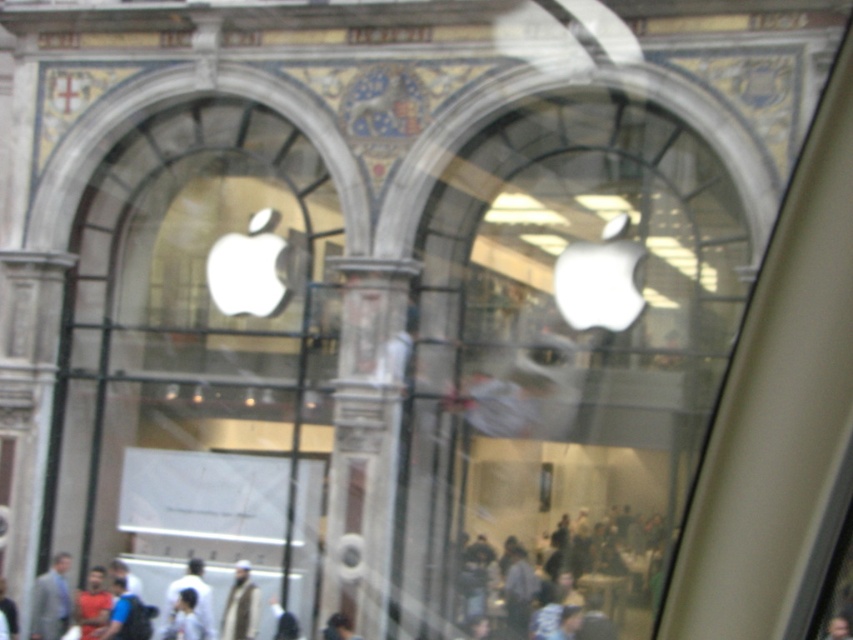
Measure the distance between gray suit at lower left and light blue shirt at lower left.

They are 18.65 feet apart.

I want to click on gray suit at lower left, so click(x=51, y=600).

Is point (59, 563) more distant than point (184, 600)?

Yes, point (59, 563) is farther from viewer.

Find the location of a particular element. The height and width of the screenshot is (640, 853). gray suit at lower left is located at coordinates (51, 600).

Can you confirm if transparent glass apple logo at center is positioned above white glass apple logo at center?

Actually, transparent glass apple logo at center is below white glass apple logo at center.

Is transparent glass apple logo at center smaller than white glass apple logo at center?

No.

Which is behind, point (459, 276) or point (270, 273)?

Point (270, 273)

Identify the location of transparent glass apple logo at center. The width and height of the screenshot is (853, 640). (561, 364).

Describe the element at coordinates (200, 349) in the screenshot. I see `white glass apple logo at center` at that location.

Find the location of `white glass apple logo at center`. white glass apple logo at center is located at coordinates (200, 349).